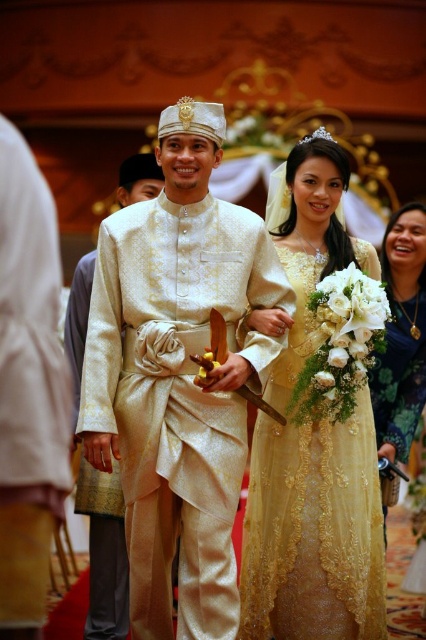
Question: Which point appears closest to the camera in this image?

Choices:
 (A) (405, 289)
 (B) (118, 616)
 (C) (138, 310)

Answer: (C)

Question: Where is golden lace dress at center located in relation to matte gold dress at lower right in the image?

Choices:
 (A) below
 (B) above

Answer: (A)

Question: Which object appears farthest from the camera in this image?

Choices:
 (A) silky cream robe at center
 (B) ivory silk robe at center

Answer: (A)

Question: Estimate the real-world distances between objects in this image. Which object is farther from the ivory silk robe at center?

Choices:
 (A) matte gold robe at left
 (B) golden lace dress at center
 (C) silky cream robe at center

Answer: (A)

Question: Is golden lace dress at center to the right of silky cream robe at center from the viewer's perspective?

Choices:
 (A) no
 (B) yes

Answer: (B)

Question: Can you confirm if silky cream robe at center is positioned below matte gold dress at lower right?

Choices:
 (A) no
 (B) yes

Answer: (B)